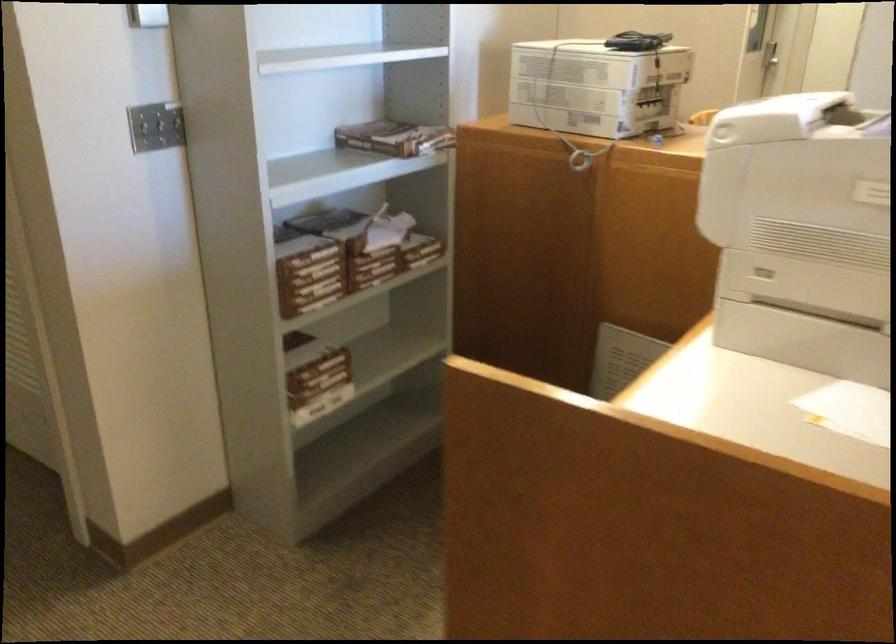
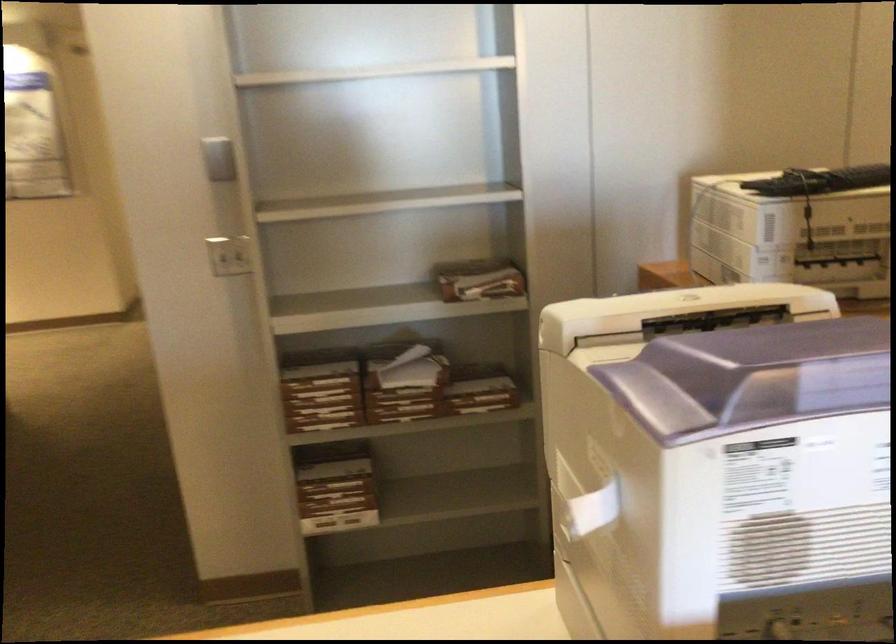
In the second image, find the point that corresponds to [139,128] in the first image.

(228, 254)